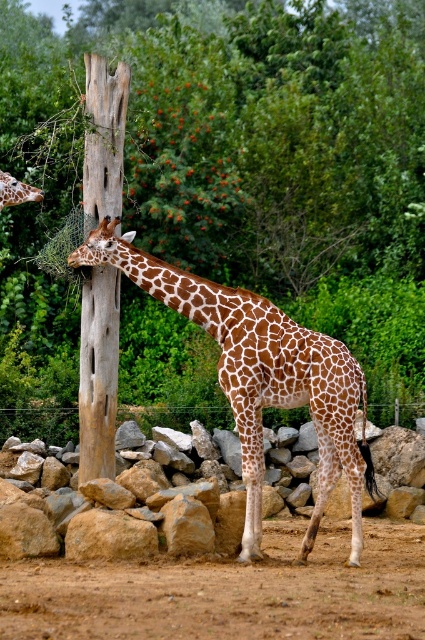
You are a zookeeper checking the enclosure for the brown spotted giraffe at left. You notice the brown rough wood at center. Based on their sizes, which object would you estimate is bigger?

The brown rough wood at center is larger in size than the brown spotted giraffe at left, so the brown rough wood at center is bigger.